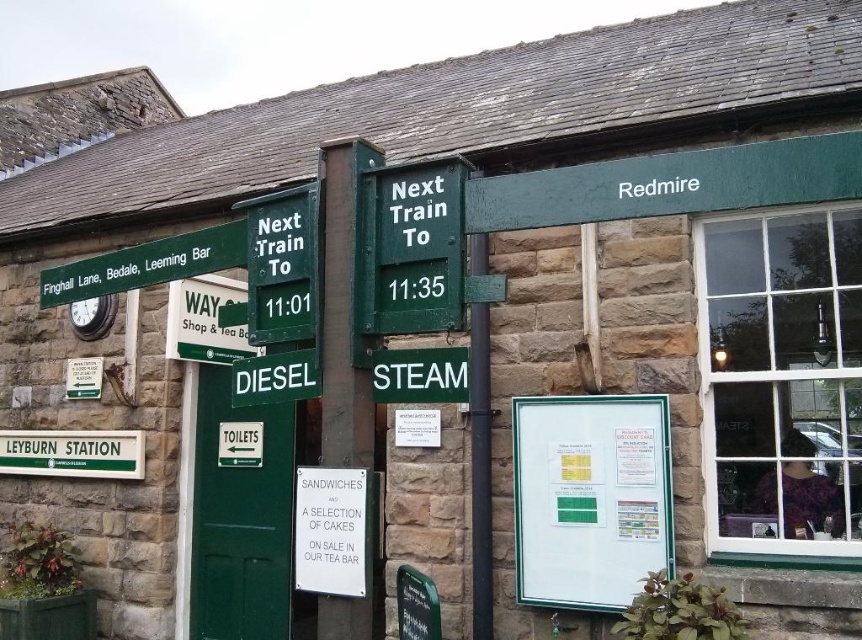
In the scene shown: You are a passenger at Leyburn Station and want to know where the whiteboard at center is located. Can you describe its position relative to the other signs?

The whiteboard at center is located at point coordinates (590, 499).

You are a traveler at Leyburn Station and need to check the next train schedule. You see a whiteboard at center and a matte green sign at center. Which one is bigger?

The whiteboard at center is larger in size than the matte green sign at center.